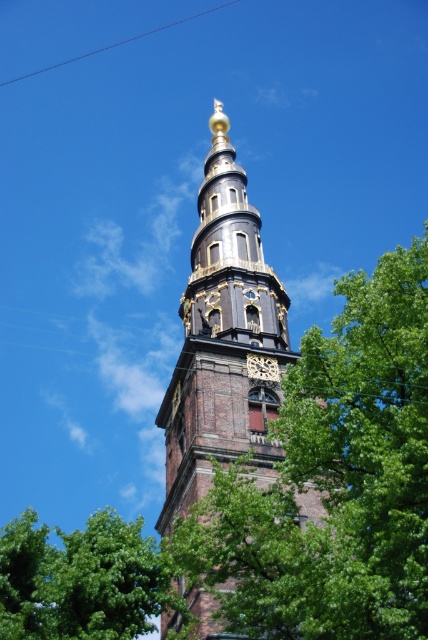
Question: Does green leafy tree at lower left have a lesser width compared to metallic wire at upper center?

Choices:
 (A) no
 (B) yes

Answer: (B)

Question: Which of the following is the farthest from the observer?

Choices:
 (A) brown brick tower at center
 (B) metallic wire at upper center

Answer: (B)

Question: Which object is closer to the camera taking this photo?

Choices:
 (A) metallic wire at upper center
 (B) brown brick tower at center

Answer: (B)

Question: Which of the following is the farthest from the observer?

Choices:
 (A) (213, 6)
 (B) (103, 637)
 (C) (184, 406)

Answer: (A)

Question: Is green leafy tree at lower left bigger than metallic wire at upper center?

Choices:
 (A) yes
 (B) no

Answer: (A)

Question: Does brown brick tower at center have a greater width compared to green leafy tree at lower left?

Choices:
 (A) no
 (B) yes

Answer: (A)